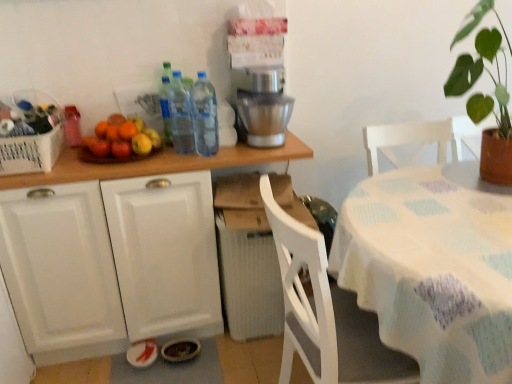
Question: In the image, is shiny plastic fruits at center left positioned in front of or behind translucent plastic bottles at upper center, marked as the second bottle in a right-to-left arrangement?

Choices:
 (A) front
 (B) behind

Answer: (A)

Question: In terms of width, does shiny plastic fruits at center left look wider or thinner when compared to translucent plastic bottles at upper center, which is the second bottle in left-to-right order?

Choices:
 (A) thin
 (B) wide

Answer: (B)

Question: Which is farther from the white wood cabinet at upper left?

Choices:
 (A) white woven basket at left
 (B) white fabric table at right
 (C) matte glass bottle at upper left, arranged as the 3th bottle when viewed from the right
 (D) shiny plastic fruits at center left
 (E) translucent plastic bottles at upper center, marked as the second bottle in a right-to-left arrangement

Answer: (B)

Question: Based on their relative distances, which object is nearer to the satin silver coffee machine at upper center?

Choices:
 (A) matte glass bottle at upper left, arranged as the 3th bottle when viewed from the right
 (B) white fabric table at right
 (C) shiny plastic fruits at center left
 (D) transparent plastic bottle at center, the third bottle viewed from the left
 (E) translucent plastic bottles at upper center, marked as the second bottle in a right-to-left arrangement

Answer: (D)